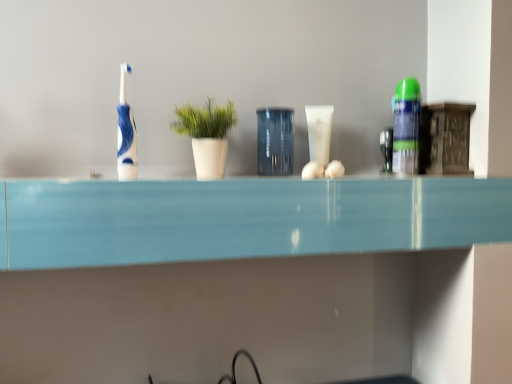
Question: Considering the positions of white glossy tube at center, arranged as the 1th toiletry when viewed from the left, and green matte plant at center in the image, is white glossy tube at center, arranged as the 1th toiletry when viewed from the left, taller or shorter than green matte plant at center?

Choices:
 (A) tall
 (B) short

Answer: (B)

Question: Is white glossy tube at center, arranged as the 1th toiletry when viewed from the left, spatially inside green matte plant at center, or outside of it?

Choices:
 (A) inside
 (B) outside

Answer: (B)

Question: Which object is the farthest from the white glossy tube at center, the second toiletry viewed from the right?

Choices:
 (A) blue glossy toothbrush at left
 (B) green matte shaving cream can at right, the first toiletry in the right-to-left sequence
 (C) transparent glass jar at center
 (D) green matte plant at center

Answer: (A)

Question: Based on their relative distances, which object is farther from the white glossy tube at center, arranged as the 1th toiletry when viewed from the left?

Choices:
 (A) transparent glass jar at center
 (B) green matte plant at center
 (C) green matte shaving cream can at right, acting as the 2th toiletry starting from the left
 (D) blue glossy toothbrush at left

Answer: (D)